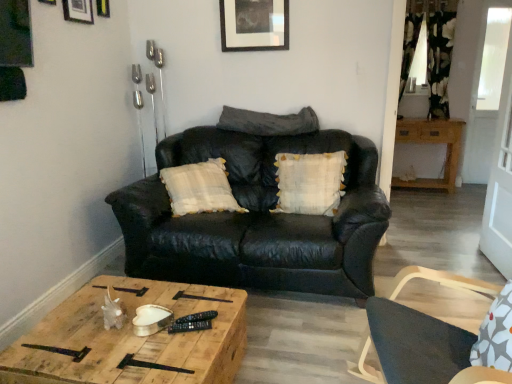
Question: Is black leather couch at center thinner than dark gray leather pillow at center, placed as the 1th pillow when sorted from top to bottom?

Choices:
 (A) no
 (B) yes

Answer: (A)

Question: Are black leather couch at center and dark gray leather pillow at center, placed as the 1th pillow when sorted from top to bottom, located far from each other?

Choices:
 (A) no
 (B) yes

Answer: (A)

Question: Is black leather couch at center smaller than dark gray leather pillow at center, the second pillow from the bottom?

Choices:
 (A) yes
 (B) no

Answer: (B)

Question: From a real-world perspective, is black leather couch at center located higher than dark gray leather pillow at center, placed as the 1th pillow when sorted from top to bottom?

Choices:
 (A) yes
 (B) no

Answer: (B)

Question: Is black leather couch at center positioned with its back to dark gray leather pillow at center, the second pillow from the bottom?

Choices:
 (A) yes
 (B) no

Answer: (B)

Question: Can you confirm if black leather couch at center is shorter than dark gray leather pillow at center, the second pillow from the bottom?

Choices:
 (A) yes
 (B) no

Answer: (B)

Question: Is black leather couch at center facing away from matte black picture frame at upper center, which appears as the first picture frame when viewed from the right?

Choices:
 (A) yes
 (B) no

Answer: (B)

Question: Is black leather couch at center next to matte black picture frame at upper center, which appears as the first picture frame when viewed from the right?

Choices:
 (A) yes
 (B) no

Answer: (B)

Question: Is the depth of black leather couch at center less than that of matte black picture frame at upper center, which is the 4th picture frame in left-to-right order?

Choices:
 (A) yes
 (B) no

Answer: (A)

Question: Is matte black picture frame at upper center, which is the 4th picture frame in left-to-right order, inside black leather couch at center?

Choices:
 (A) yes
 (B) no

Answer: (B)

Question: Can we say black leather couch at center lies outside matte black picture frame at upper center, arranged as the fourth picture frame when viewed from the front?

Choices:
 (A) no
 (B) yes

Answer: (B)

Question: Does black leather couch at center have a smaller size compared to matte black picture frame at upper center, marked as the first picture frame in a back-to-front arrangement?

Choices:
 (A) no
 (B) yes

Answer: (A)

Question: From the image's perspective, would you say wooden cabinet at right, placed as the 1th table when sorted from back to front, is positioned over metallic silver picture frame at upper center, which is the third picture frame in front-to-back order?

Choices:
 (A) yes
 (B) no

Answer: (B)